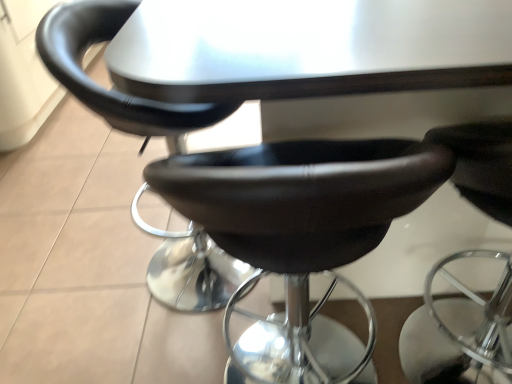
Question: In which direction should I rotate to look at matte black stool at center, which is counted as the 3th chair, starting from the right?

Choices:
 (A) left
 (B) right

Answer: (A)

Question: Can you confirm if matte black stool at center, acting as the first chair starting from the left, is positioned to the left of black leather stool at center, which is counted as the second chair, starting from the right?

Choices:
 (A) yes
 (B) no

Answer: (A)

Question: Can you see matte black stool at center, which is counted as the 3th chair, starting from the right, touching black leather stool at center, which is counted as the second chair, starting from the right?

Choices:
 (A) no
 (B) yes

Answer: (A)

Question: Is matte black stool at center, which is counted as the 3th chair, starting from the right, bigger than black leather stool at center, which is counted as the second chair, starting from the right?

Choices:
 (A) no
 (B) yes

Answer: (B)

Question: Considering the relative sizes of matte black stool at center, which is counted as the 3th chair, starting from the right, and black leather stool at center, acting as the 2th chair starting from the left, in the image provided, is matte black stool at center, which is counted as the 3th chair, starting from the right, wider than black leather stool at center, acting as the 2th chair starting from the left,?

Choices:
 (A) no
 (B) yes

Answer: (B)

Question: Is matte black stool at center, which is counted as the 3th chair, starting from the right, closer to the viewer compared to black leather stool at center, acting as the 2th chair starting from the left?

Choices:
 (A) yes
 (B) no

Answer: (B)

Question: Considering the relative sizes of matte black stool at center, acting as the first chair starting from the left, and black leather stool at center, which is counted as the second chair, starting from the right, in the image provided, is matte black stool at center, acting as the first chair starting from the left, thinner than black leather stool at center, which is counted as the second chair, starting from the right,?

Choices:
 (A) no
 (B) yes

Answer: (A)

Question: From a real-world perspective, is black leather stool at center, acting as the 2th chair starting from the left, on matte black stool at center, acting as the first chair starting from the left?

Choices:
 (A) yes
 (B) no

Answer: (B)

Question: Is black leather stool at center, acting as the 2th chair starting from the left, thinner than matte black stool at center, which is counted as the 3th chair, starting from the right?

Choices:
 (A) yes
 (B) no

Answer: (A)

Question: Does black leather stool at center, which is counted as the second chair, starting from the right, have a greater height compared to matte black stool at center, acting as the first chair starting from the left?

Choices:
 (A) no
 (B) yes

Answer: (A)

Question: Is black leather stool at center, which is counted as the second chair, starting from the right, completely or partially outside of matte black stool at center, acting as the first chair starting from the left?

Choices:
 (A) yes
 (B) no

Answer: (A)

Question: Is black leather stool at center, acting as the 2th chair starting from the left, to the left of matte black stool at center, which is counted as the 3th chair, starting from the right, from the viewer's perspective?

Choices:
 (A) no
 (B) yes

Answer: (A)

Question: From the image's perspective, does black leather stool at center, which is counted as the second chair, starting from the right, appear lower than matte black stool at center, acting as the first chair starting from the left?

Choices:
 (A) no
 (B) yes

Answer: (B)

Question: Is black leather chair at center, the third chair when ordered from left to right, next to matte black stool at center, acting as the first chair starting from the left, and touching it?

Choices:
 (A) yes
 (B) no

Answer: (B)